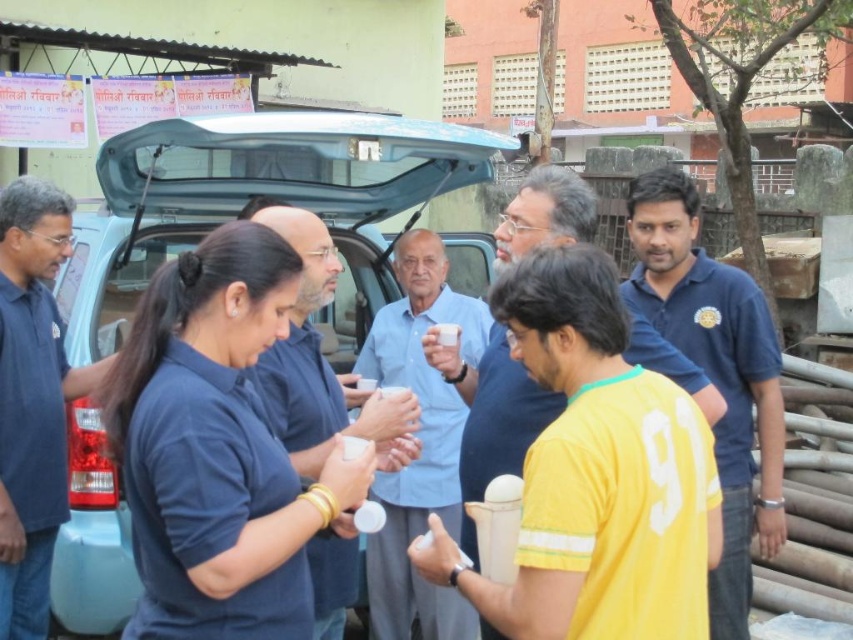
Question: Can you confirm if light blue matte car at center is thinner than matte blue shirt at center?

Choices:
 (A) yes
 (B) no

Answer: (B)

Question: Which point is farther to the camera?

Choices:
 (A) matte blue shirt at center
 (B) blue cotton shirt at right
 (C) light blue shirt at center

Answer: (C)

Question: Which of these objects is positioned farthest from the light blue shirt at center?

Choices:
 (A) matte blue shirt at center
 (B) blue cotton shirt at right
 (C) light blue matte car at center

Answer: (B)

Question: Does blue cotton shirt at right come in front of yellow jersey at center?

Choices:
 (A) no
 (B) yes

Answer: (A)

Question: Observing the image, what is the correct spatial positioning of matte blue shirt at center in reference to yellow jersey at center?

Choices:
 (A) right
 (B) left

Answer: (B)

Question: Among these objects, which one is nearest to the camera?

Choices:
 (A) light blue shirt at center
 (B) light blue matte car at center
 (C) matte blue shirt at center
 (D) dark blue shirt at left

Answer: (C)